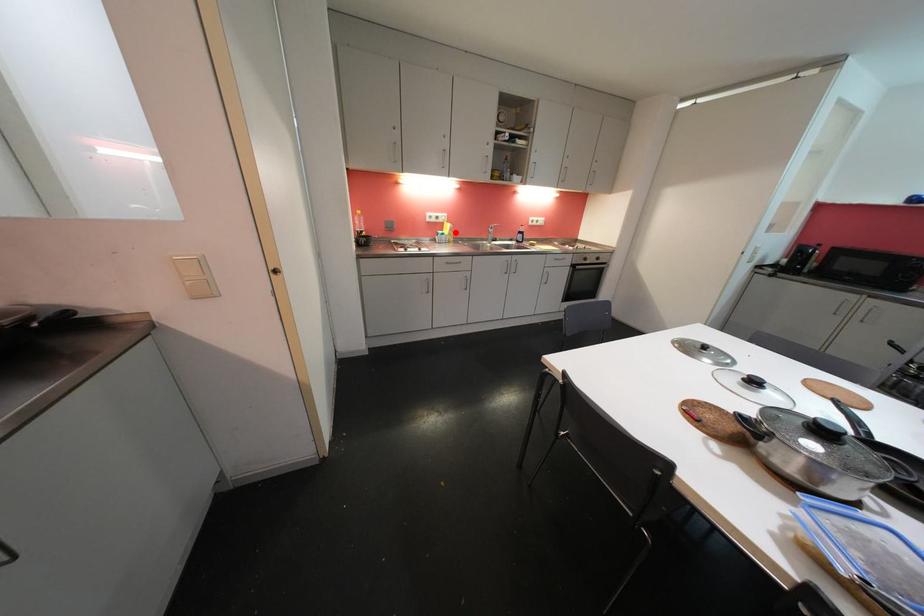
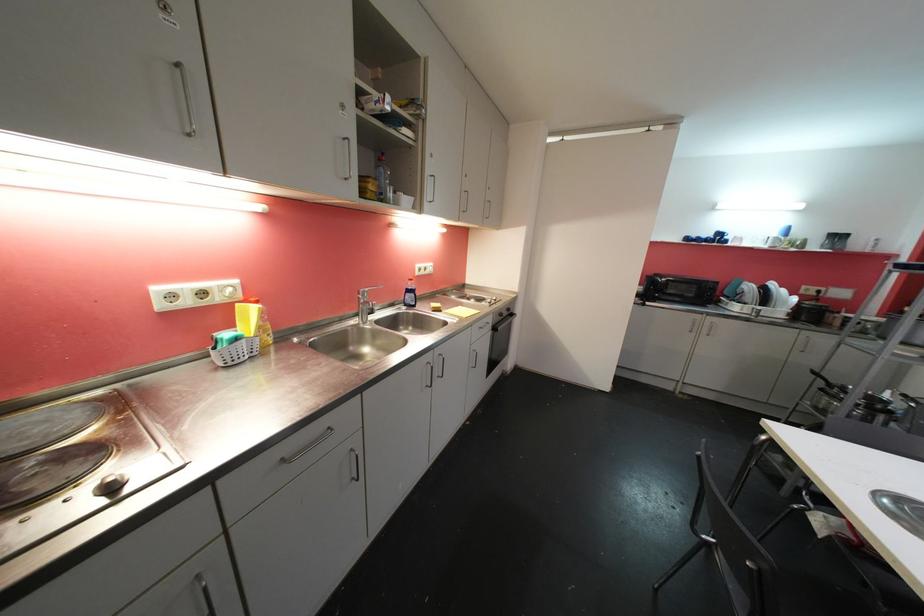
Locate, in the second image, the point that corresponds to the highlighted location in the first image.

(265, 322)